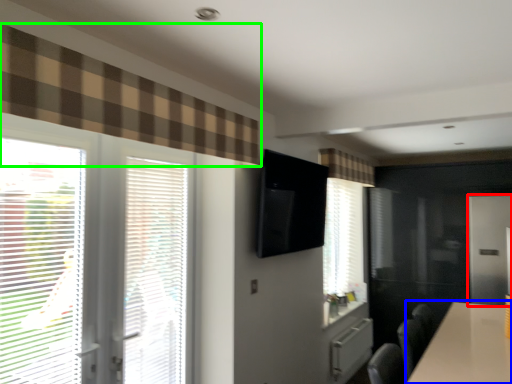
Question: Which is farther away from screen door (highlighted by a red box)? table (highlighted by a blue box) or curtain (highlighted by a green box)?

Choices:
 (A) table
 (B) curtain

Answer: (B)